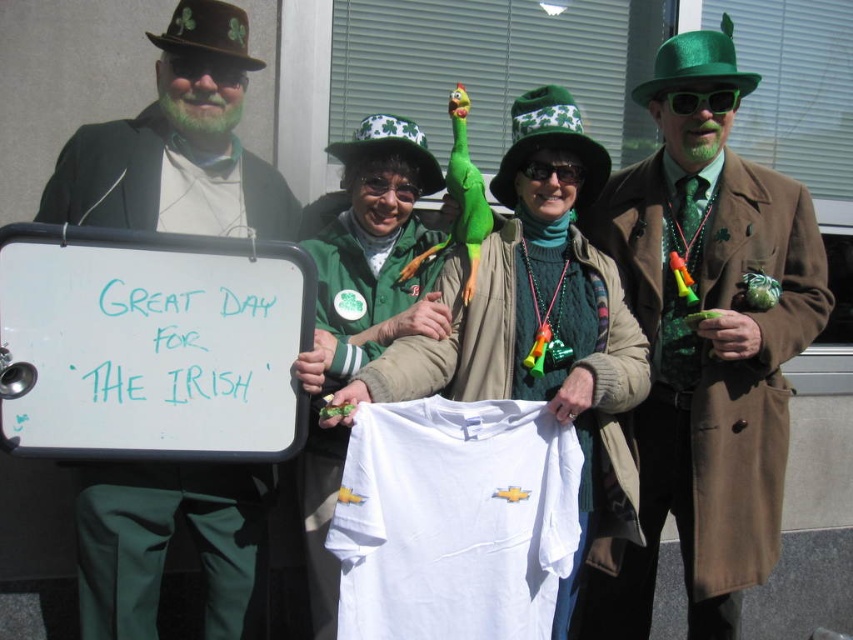
Is green felt hat at upper right closer to the viewer compared to green fabric shirt at center?

No.

Does green felt hat at upper right appear under green fabric shirt at center?

Actually, green felt hat at upper right is above green fabric shirt at center.

At what (x,y) coordinates should I click in order to perform the action: click on green felt hat at upper right. Please return your answer as a coordinate pair (x, y). The height and width of the screenshot is (640, 853). Looking at the image, I should click on (706, 340).

Does green felt hat at upper right have a greater height compared to matte green suit at left?

Correct, green felt hat at upper right is much taller as matte green suit at left.

In the scene shown: Between green felt hat at upper right and matte green suit at left, which one has more height?

green felt hat at upper right

This screenshot has height=640, width=853. Describe the element at coordinates (706, 340) in the screenshot. I see `green felt hat at upper right` at that location.

Identify the location of green felt hat at upper right. tap(706, 340).

Between green felt hat at upper right and white cotton t-shirt at center, which one is positioned higher?

green felt hat at upper right

Does green felt hat at upper right lie in front of white cotton t-shirt at center?

That is False.

Which is in front, point (773, 499) or point (490, 394)?

Point (490, 394)

Where is `green felt hat at upper right`? This screenshot has height=640, width=853. green felt hat at upper right is located at coordinates (706, 340).